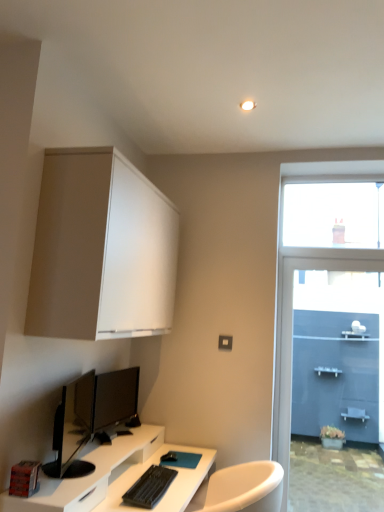
The height and width of the screenshot is (512, 384). What do you see at coordinates (333, 215) in the screenshot? I see `transparent glass window at upper right` at bounding box center [333, 215].

This screenshot has height=512, width=384. Describe the element at coordinates (115, 400) in the screenshot. I see `black glossy monitor at center, the 1th computer monitor when ordered from back to front` at that location.

Identify the location of black glossy monitor at center, the 1th computer monitor when ordered from back to front. (115, 400).

Describe the element at coordinates (101, 250) in the screenshot. I see `matte white cabinet at upper left` at that location.

What is the approximate height of black glossy monitor at lower left, positioned as the 2th computer monitor in back-to-front order?

16.08 inches.

Locate an element on the screen. This screenshot has width=384, height=512. transparent glass window at upper right is located at coordinates (333, 215).

Is blue matte wall at right oriented away from white glossy desk at lower left?

No, blue matte wall at right's orientation is not away from white glossy desk at lower left.

Is blue matte wall at right next to white glossy desk at lower left?

blue matte wall at right is not next to white glossy desk at lower left, and they're not touching.

Considering the relative sizes of blue matte wall at right and white glossy desk at lower left in the image provided, is blue matte wall at right smaller than white glossy desk at lower left?

Yes.

Is blue matte wall at right positioned beyond the bounds of white glossy desk at lower left?

Yes, blue matte wall at right is outside of white glossy desk at lower left.

Is black matte keyboard at lower center wider than black glossy monitor at lower left, placed as the first computer monitor when sorted from front to back?

In fact, black matte keyboard at lower center might be narrower than black glossy monitor at lower left, placed as the first computer monitor when sorted from front to back.

Do you think black matte keyboard at lower center is within black glossy monitor at lower left, placed as the first computer monitor when sorted from front to back, or outside of it?

black matte keyboard at lower center exists outside the volume of black glossy monitor at lower left, placed as the first computer monitor when sorted from front to back.

From the image's perspective, would you say black matte keyboard at lower center is shown under black glossy monitor at lower left, placed as the first computer monitor when sorted from front to back?

Yes, from the image's perspective, black matte keyboard at lower center is below black glossy monitor at lower left, placed as the first computer monitor when sorted from front to back.

How distant is black glossy monitor at lower left, positioned as the 2th computer monitor in back-to-front order, from matte white cabinet at upper left?

black glossy monitor at lower left, positioned as the 2th computer monitor in back-to-front order, is 25.87 inches away from matte white cabinet at upper left.

Is black glossy monitor at lower left, placed as the first computer monitor when sorted from front to back, surrounding matte white cabinet at upper left?

No, matte white cabinet at upper left is located outside of black glossy monitor at lower left, placed as the first computer monitor when sorted from front to back.

Considering the relative positions of black glossy monitor at lower left, placed as the first computer monitor when sorted from front to back, and matte white cabinet at upper left in the image provided, is black glossy monitor at lower left, placed as the first computer monitor when sorted from front to back, to the left of matte white cabinet at upper left from the viewer's perspective?

Yes.

From the image's perspective, is black glossy monitor at lower left, positioned as the 2th computer monitor in back-to-front order, located above or below matte white cabinet at upper left?

black glossy monitor at lower left, positioned as the 2th computer monitor in back-to-front order, is situated lower than matte white cabinet at upper left in the image.

Identify the location of desk in front of the black matte keyboard at lower center. (116, 477).

Does white glossy desk at lower left appear on the left side of black matte keyboard at lower center?

Yes.

From a real-world perspective, is white glossy desk at lower left physically located above or below black matte keyboard at lower center?

white glossy desk at lower left is below black matte keyboard at lower center.

In the scene shown: Is white glossy desk at lower left bigger than black matte keyboard at lower center?

Correct, white glossy desk at lower left is larger in size than black matte keyboard at lower center.

Does matte white cabinet at upper left appear on the right side of blue matte wall at right?

In fact, matte white cabinet at upper left is to the left of blue matte wall at right.

Considering the positions of points (128, 193) and (275, 300), is point (128, 193) farther from camera compared to point (275, 300)?

No, (128, 193) is in front of (275, 300).

Does matte white cabinet at upper left have a lesser width compared to blue matte wall at right?

Incorrect, the width of matte white cabinet at upper left is not less than that of blue matte wall at right.

Is matte white cabinet at upper left closer to camera compared to transparent glass window at upper right?

Yes, matte white cabinet at upper left is closer to the camera.

Can we say matte white cabinet at upper left lies outside transparent glass window at upper right?

Indeed, matte white cabinet at upper left is completely outside transparent glass window at upper right.

Considering the relative positions of matte white cabinet at upper left and transparent glass window at upper right in the image provided, is matte white cabinet at upper left to the right of transparent glass window at upper right from the viewer's perspective?

In fact, matte white cabinet at upper left is to the left of transparent glass window at upper right.

Consider the image. Can you tell me how much matte white cabinet at upper left and transparent glass window at upper right differ in facing direction?

90.3 degrees.

Is black glossy monitor at lower left, placed as the first computer monitor when sorted from front to back, next to transparent glass window at upper right?

No, black glossy monitor at lower left, placed as the first computer monitor when sorted from front to back, is not touching transparent glass window at upper right.

Measure the distance between black glossy monitor at lower left, placed as the first computer monitor when sorted from front to back, and transparent glass window at upper right.

A distance of 5.85 feet exists between black glossy monitor at lower left, placed as the first computer monitor when sorted from front to back, and transparent glass window at upper right.

Is black glossy monitor at lower left, positioned as the 2th computer monitor in back-to-front order, taller than transparent glass window at upper right?

No, black glossy monitor at lower left, positioned as the 2th computer monitor in back-to-front order, is not taller than transparent glass window at upper right.

Is black glossy monitor at lower left, positioned as the 2th computer monitor in back-to-front order, located outside transparent glass window at upper right?

Yes, black glossy monitor at lower left, positioned as the 2th computer monitor in back-to-front order, is not within transparent glass window at upper right.

The height and width of the screenshot is (512, 384). What are the coordinates of `desk below the blue matte wall at right (from the image's perspective)` in the screenshot? It's located at (116, 477).

Find the location of a particular element. Image resolution: width=384 pixels, height=512 pixels. computer keyboard on the right of black glossy monitor at lower left, positioned as the 2th computer monitor in back-to-front order is located at coordinates (150, 487).

Looking at the image, which one is located further to black glossy monitor at lower left, positioned as the 2th computer monitor in back-to-front order, black matte keyboard at lower center or white glossy desk at lower left?

black matte keyboard at lower center lies further to black glossy monitor at lower left, positioned as the 2th computer monitor in back-to-front order, than the other object.

From the picture: Which object lies further to the anchor point black glossy monitor at lower left, placed as the first computer monitor when sorted from front to back, black matte keyboard at lower center or blue matte wall at right?

blue matte wall at right.

From the image, which object appears to be farther from matte white cabinet at upper left, black glossy monitor at center, the 1th computer monitor when ordered from back to front, or blue matte wall at right?

The object further to matte white cabinet at upper left is blue matte wall at right.

When comparing their distances from black glossy monitor at lower left, placed as the first computer monitor when sorted from front to back, does white glossy desk at lower left or black glossy monitor at center, the 1th computer monitor when ordered from back to front, seem closer?

black glossy monitor at center, the 1th computer monitor when ordered from back to front, is positioned closer to the anchor black glossy monitor at lower left, placed as the first computer monitor when sorted from front to back.

Estimate the real-world distances between objects in this image. Which object is further from black matte keyboard at lower center, blue matte wall at right or black glossy monitor at lower left, placed as the first computer monitor when sorted from front to back?

The object further to black matte keyboard at lower center is blue matte wall at right.

When comparing their distances from white glossy desk at lower left, does black glossy monitor at lower left, positioned as the 2th computer monitor in back-to-front order, or transparent glass window at upper right seem further?

transparent glass window at upper right.

Which object lies nearer to the anchor point white glossy desk at lower left, black glossy monitor at center, which appears as the second computer monitor when viewed from the front, or black glossy monitor at lower left, placed as the first computer monitor when sorted from front to back?

Based on the image, black glossy monitor at lower left, placed as the first computer monitor when sorted from front to back, appears to be nearer to white glossy desk at lower left.

Based on their spatial positions, is transparent glass window at upper right or white glossy desk at lower left further from matte white cabinet at upper left?

transparent glass window at upper right lies further to matte white cabinet at upper left than the other object.

Locate an element on the screen. This screenshot has height=512, width=384. computer keyboard situated between matte white cabinet at upper left and blue matte wall at right from left to right is located at coordinates (150, 487).

Locate an element on the screen. cabinetry between black glossy monitor at lower left, positioned as the 2th computer monitor in back-to-front order, and blue matte wall at right, in the horizontal direction is located at coordinates (101, 250).

At what (x,y) coordinates should I click in order to perform the action: click on computer monitor situated between black glossy monitor at lower left, positioned as the 2th computer monitor in back-to-front order, and transparent glass window at upper right from left to right. Please return your answer as a coordinate pair (x, y). Looking at the image, I should click on (115, 400).

Identify the location of cabinetry between black glossy monitor at center, the 1th computer monitor when ordered from back to front, and blue matte wall at right from left to right. The height and width of the screenshot is (512, 384). (101, 250).